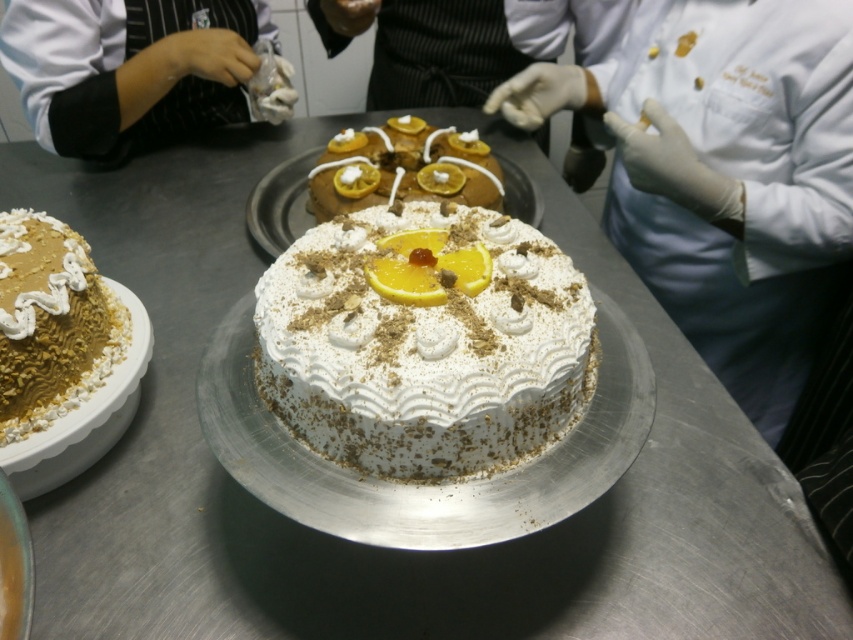
Question: Does golden textured dome at left appear on the right side of glazed orange cake at center?

Choices:
 (A) yes
 (B) no

Answer: (B)

Question: Among these objects, which one is farthest from the camera?

Choices:
 (A) glazed orange cake at center
 (B) white chef coat at upper left
 (C) white cream cake at center
 (D) golden textured dome at left

Answer: (B)

Question: Is white chef coat at upper left to the right of golden textured dome at left from the viewer's perspective?

Choices:
 (A) no
 (B) yes

Answer: (A)

Question: Which point appears farthest from the camera in this image?

Choices:
 (A) (404, 180)
 (B) (91, 314)
 (C) (325, 451)
 (D) (728, 196)

Answer: (A)

Question: Can you confirm if white chef coat at upper left is positioned to the right of glazed orange cake at center?

Choices:
 (A) yes
 (B) no

Answer: (B)

Question: Which point is farther to the camera?

Choices:
 (A) white cream cake at center
 (B) white chef coat at upper left

Answer: (B)